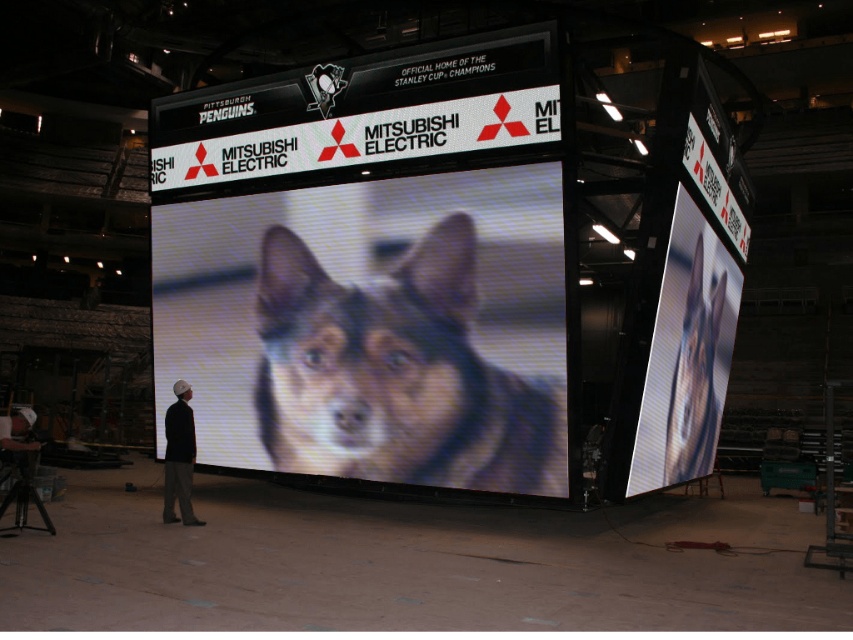
Does brown fur dog at center have a greater width compared to shiny digital display at center?

Indeed, brown fur dog at center has a greater width compared to shiny digital display at center.

Is point (421, 387) closer to camera compared to point (672, 252)?

Yes.

The image size is (853, 640). What do you see at coordinates (392, 372) in the screenshot?
I see `brown fur dog at center` at bounding box center [392, 372].

Image resolution: width=853 pixels, height=640 pixels. What are the coordinates of `brown fur dog at center` in the screenshot? It's located at [392, 372].

Between brown fur dog at center and white plastic sign at upper center, which one is positioned lower?

brown fur dog at center

Measure the distance between brown fur dog at center and white plastic sign at upper center.

8.67 feet

Find the location of `brown fur dog at center`. brown fur dog at center is located at coordinates (392, 372).

The height and width of the screenshot is (640, 853). Find the location of `brown fur dog at center`. brown fur dog at center is located at coordinates (392, 372).

Who is taller, brown fur dog at center or dark gray knit cap at center?

With more height is brown fur dog at center.

Where is `brown fur dog at center`? The width and height of the screenshot is (853, 640). brown fur dog at center is located at coordinates (392, 372).

Is point (358, 396) farther from viewer compared to point (171, 435)?

Yes, point (358, 396) is behind point (171, 435).

You are a GUI agent. You are given a task and a screenshot of the screen. Output one action in this format:
    pyautogui.click(x=<x>, y=<y>)
    Task: Click on the brown fur dog at center
    
    Given the screenshot: What is the action you would take?
    pyautogui.click(x=392, y=372)